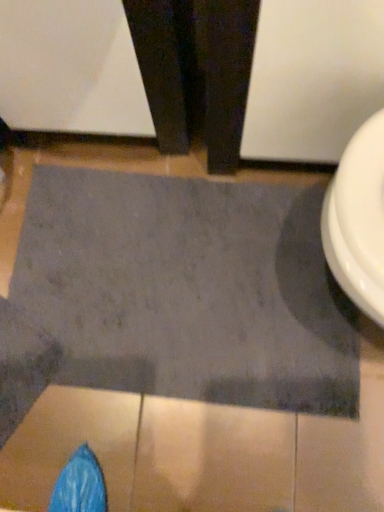
Where is `dark gray carpet at center`? This screenshot has width=384, height=512. dark gray carpet at center is located at coordinates (187, 290).

Measure the distance between point (x=325, y=362) and camera.

The depth of point (x=325, y=362) is 93.60 centimeters.

What do you see at coordinates (187, 290) in the screenshot?
I see `dark gray carpet at center` at bounding box center [187, 290].

Image resolution: width=384 pixels, height=512 pixels. What are the coordinates of `dark gray carpet at center` in the screenshot? It's located at (187, 290).